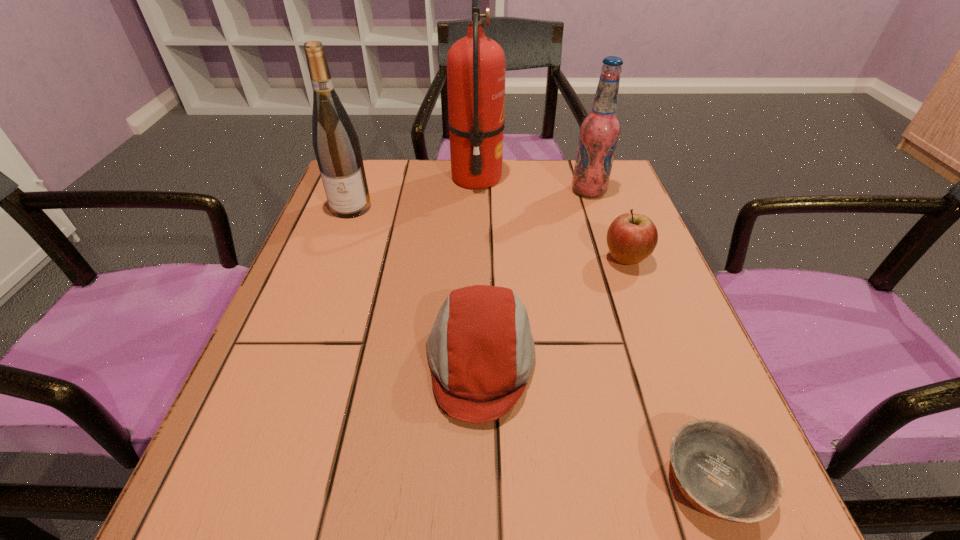
Where is `fire extinguisher`? This screenshot has height=540, width=960. fire extinguisher is located at coordinates (475, 63).

Where is `wine bottle`? wine bottle is located at coordinates (336, 145).

The width and height of the screenshot is (960, 540). In order to click on alcohol in this screenshot , I will do `click(599, 131)`.

Where is `the third nearest object`? Image resolution: width=960 pixels, height=540 pixels. the third nearest object is located at coordinates (631, 238).

Find the location of a particular element. the second nearest object is located at coordinates (481, 352).

What are the coordinates of `the shortest object` in the screenshot? It's located at (721, 470).

This screenshot has height=540, width=960. In order to click on the nearest object in this screenshot , I will do `click(721, 470)`.

Where is `vacant region located 0.220m on the side of the fire extinguisher with the nozzle and handle`? The image size is (960, 540). vacant region located 0.220m on the side of the fire extinguisher with the nozzle and handle is located at coordinates (587, 178).

Locate an element on the screen. This screenshot has height=540, width=960. blank area located on the right of the leftmost object is located at coordinates (455, 207).

The height and width of the screenshot is (540, 960). What are the coordinates of `free space located on the left of the alcohol` in the screenshot? It's located at (511, 191).